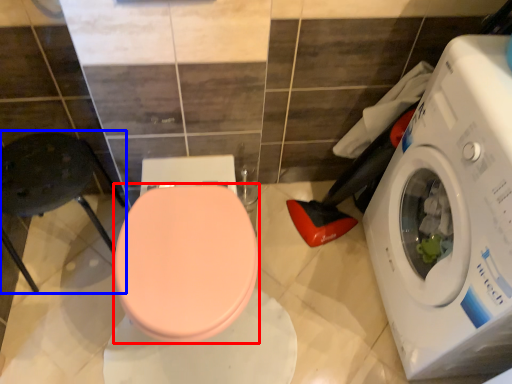
Question: Which object appears closest to the camera in this image, bidet (highlighted by a red box) or chair (highlighted by a blue box)?

Choices:
 (A) bidet
 (B) chair

Answer: (A)